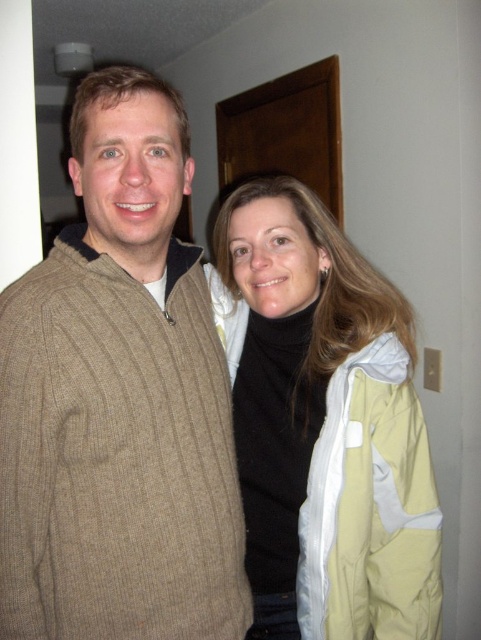
Question: Which point is closer to the camera?

Choices:
 (A) knit sweater at left
 (B) light yellow jacket at center

Answer: (A)

Question: Which object is farther from the camera taking this photo?

Choices:
 (A) light yellow jacket at center
 (B) knit sweater at left

Answer: (A)

Question: Which object is closer to the camera taking this photo?

Choices:
 (A) knit sweater at left
 (B) light yellow jacket at center

Answer: (A)

Question: Is knit sweater at left thinner than light yellow jacket at center?

Choices:
 (A) yes
 (B) no

Answer: (A)

Question: In this image, where is knit sweater at left located relative to light yellow jacket at center?

Choices:
 (A) below
 (B) above

Answer: (B)

Question: Does knit sweater at left have a larger size compared to light yellow jacket at center?

Choices:
 (A) yes
 (B) no

Answer: (A)